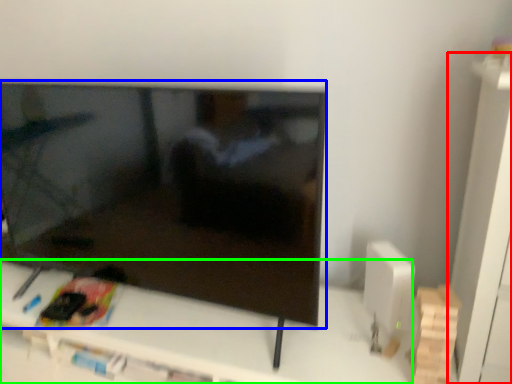
Question: Which is farther away from tv cabinet (highlighted by a red box)? television (highlighted by a blue box) or furniture (highlighted by a green box)?

Choices:
 (A) television
 (B) furniture

Answer: (A)